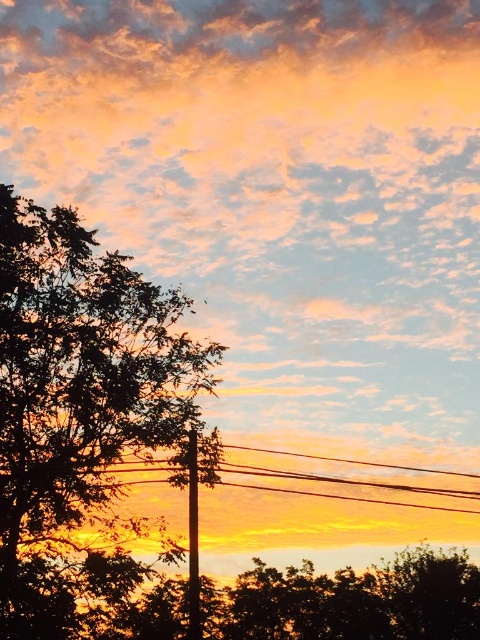
Question: Is green leafy tree at left to the right of black wire at center from the viewer's perspective?

Choices:
 (A) yes
 (B) no

Answer: (B)

Question: Which is nearer to the black wire at center?

Choices:
 (A) green leafy tree at left
 (B) smooth black pole at center

Answer: (A)

Question: Does green leafy tree at left appear over black wire at center?

Choices:
 (A) no
 (B) yes

Answer: (B)

Question: Which point is closer to the camera taking this photo?

Choices:
 (A) [x=195, y=616]
 (B) [x=351, y=499]
 (C) [x=56, y=570]

Answer: (A)

Question: Which of the following is the farthest from the observer?

Choices:
 (A) smooth black pole at center
 (B) black wire at center

Answer: (B)

Question: Does black wire at center appear under smooth black pole at center?

Choices:
 (A) no
 (B) yes

Answer: (A)